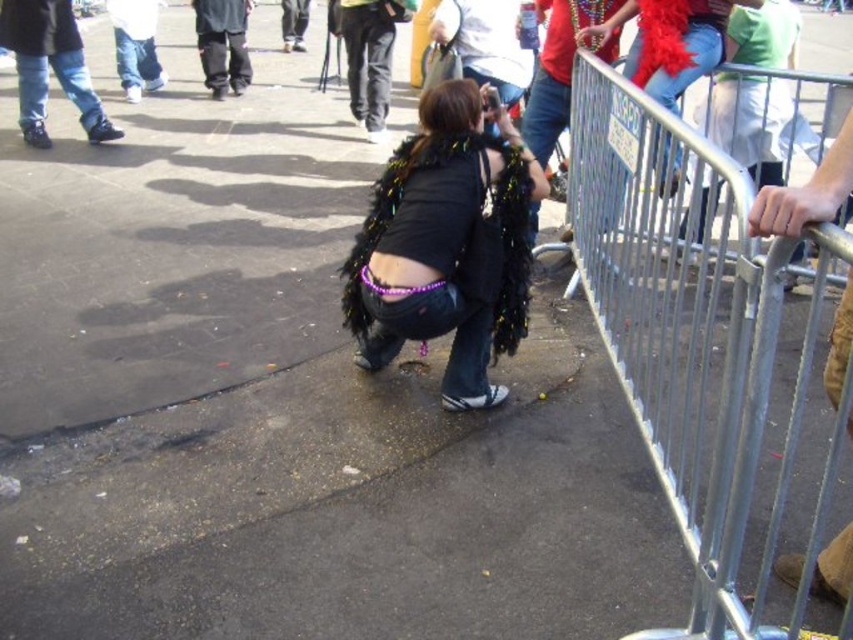
Which is in front, point (749, 618) or point (519, 317)?

Point (749, 618) is more forward.

Can you confirm if silver metallic rail at right is positioned below black sequined feather boa at center?

Indeed, silver metallic rail at right is positioned under black sequined feather boa at center.

Who is more distant from viewer, [701,465] or [386,264]?

Positioned behind is point [386,264].

Locate an element on the screen. The height and width of the screenshot is (640, 853). silver metallic rail at right is located at coordinates tap(711, 356).